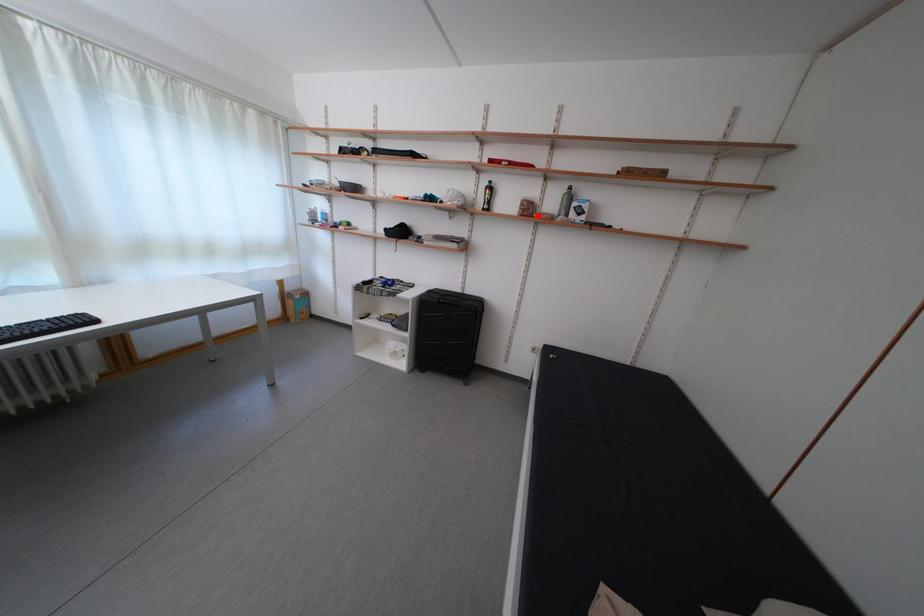
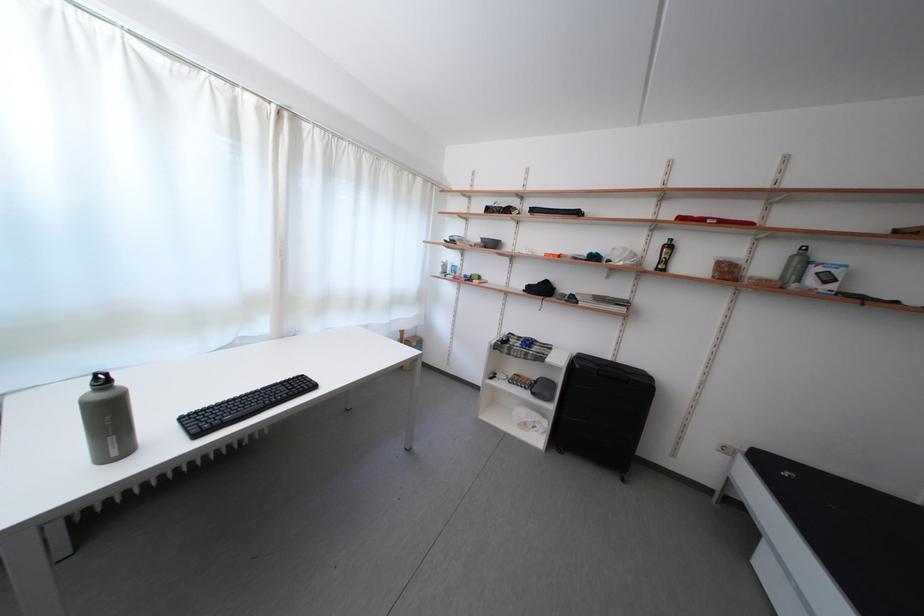
Question: A red point is marked in image1. In image2, is the corresponding 3D point closer to the camera or farther? Reply with the corresponding letter.

Choices:
 (A) The corresponding 3D point is closer.
 (B) The corresponding 3D point is farther.

Answer: (B)